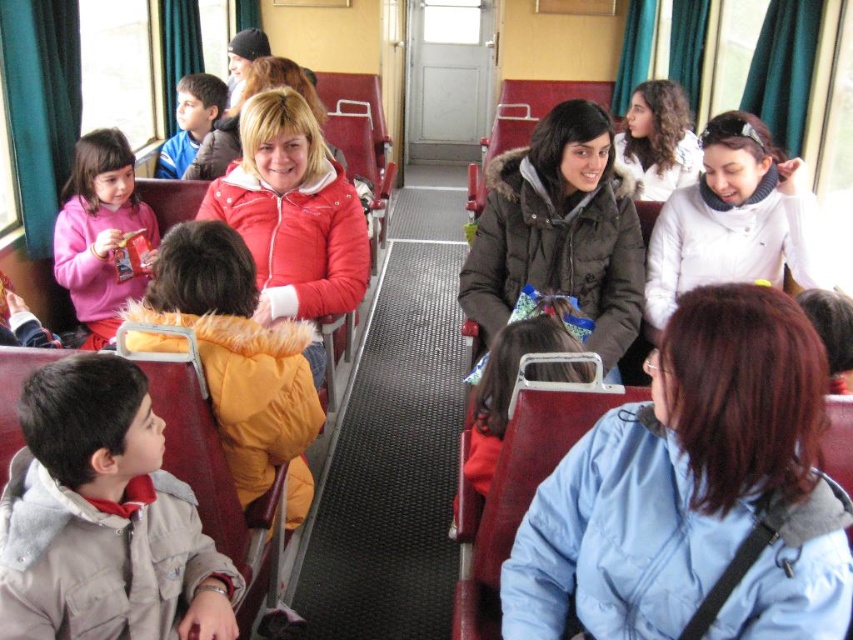
Question: Does light gray fleece jacket at lower left appear over dark brown puffy coat at center?

Choices:
 (A) yes
 (B) no

Answer: (B)

Question: Is dark brown puffy coat at center to the right of matte red jacket at center from the viewer's perspective?

Choices:
 (A) no
 (B) yes

Answer: (B)

Question: Among these objects, which one is nearest to the camera?

Choices:
 (A) dark brown puffy coat at center
 (B) blue fabric jacket at upper left
 (C) curly hair at upper right

Answer: (A)

Question: Estimate the real-world distances between objects in this image. Which object is farther from the light gray fleece jacket at lower left?

Choices:
 (A) fuzzy yellow jacket at center
 (B) curly hair at upper right
 (C) blue fuzzy jacket at lower right
 (D) blue fabric jacket at upper left

Answer: (D)

Question: Is light gray fleece jacket at lower left in front of white fleece sweater at upper right?

Choices:
 (A) yes
 (B) no

Answer: (A)

Question: Among these points, which one is nearest to the camera?

Choices:
 (A) (183, 104)
 (B) (32, 490)
 (C) (622, 502)

Answer: (C)